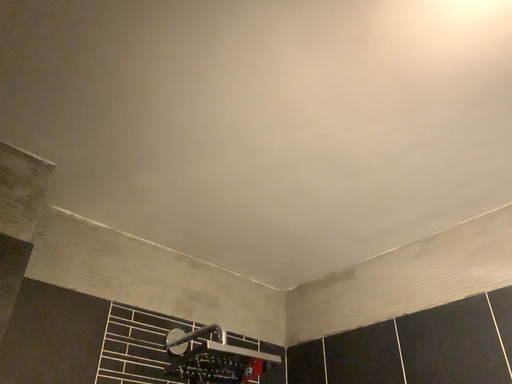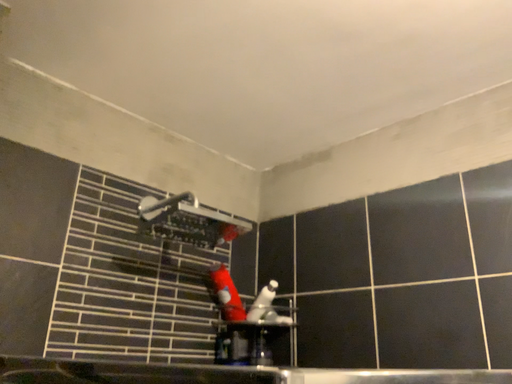
Question: How did the camera likely rotate when shooting the video?

Choices:
 (A) rotated upward
 (B) rotated downward

Answer: (B)